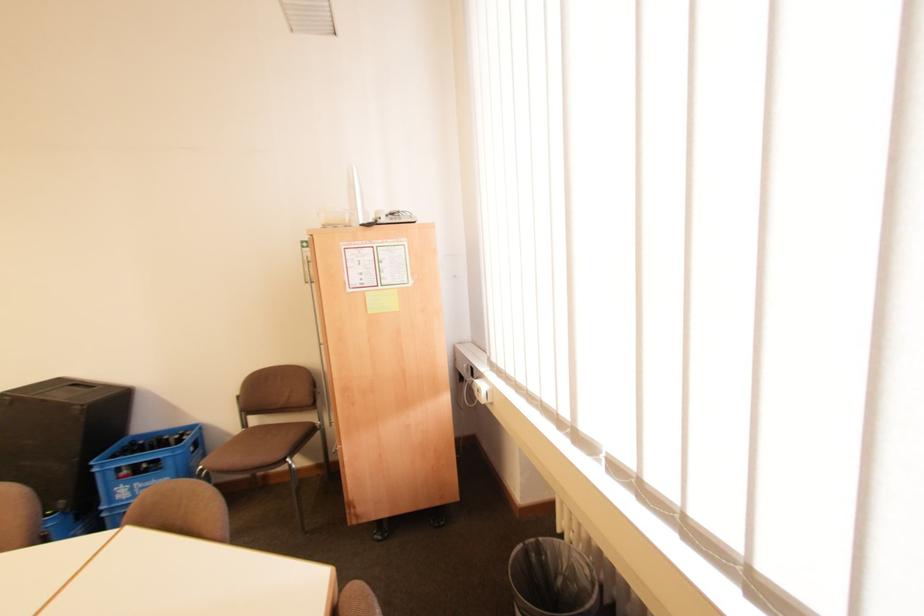
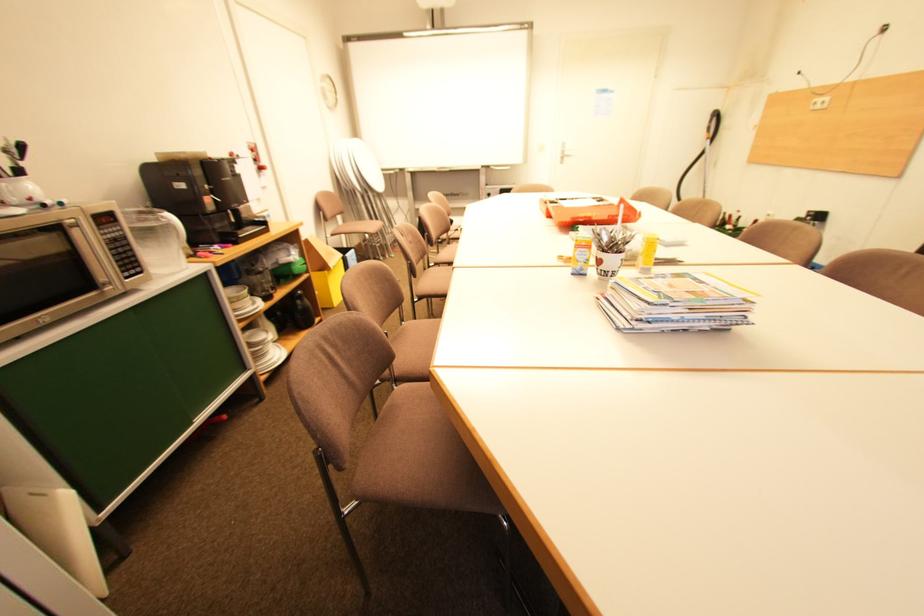
The first image is from the beginning of the video and the second image is from the end. How did the camera likely rotate when shooting the video?

The rotation direction of the camera is left-down.